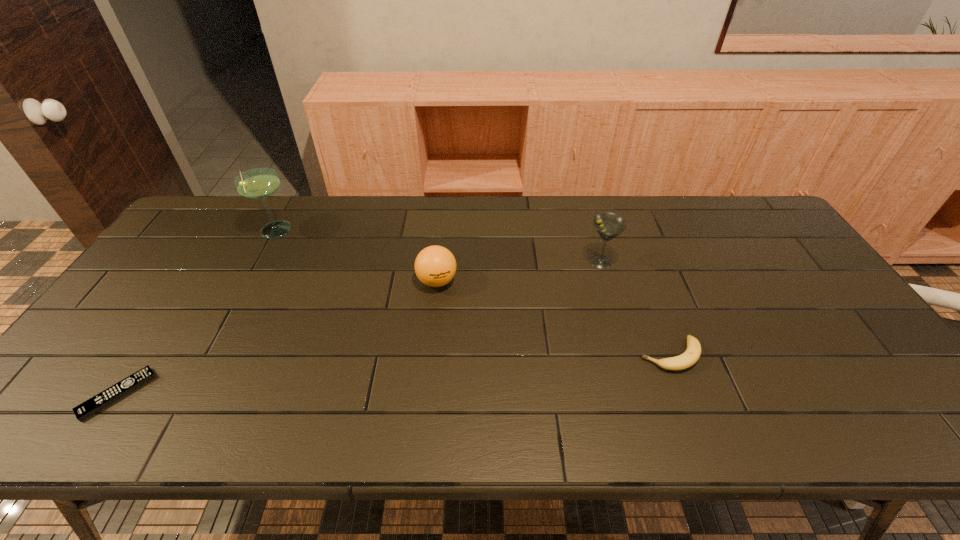
The height and width of the screenshot is (540, 960). In order to click on vacant space that's between the banana and the remote control in this screenshot , I will do `click(394, 375)`.

Where is `vacant space in between the third shortest object and the shorter martini`? vacant space in between the third shortest object and the shorter martini is located at coordinates (518, 272).

This screenshot has width=960, height=540. In order to click on free space between the third shortest object and the fourth tallest object in this screenshot , I will do `click(554, 318)`.

Select which object appears as the third closest to the fourth shortest object. Please provide its 2D coordinates. Your answer should be formatted as a tuple, i.e. [(x, y)], where the tuple contains the x and y coordinates of a point satisfying the conditions above.

[(259, 183)]

This screenshot has width=960, height=540. Identify the location of object identified as the second closest to the banana. (435, 266).

Locate an element on the screen. The width and height of the screenshot is (960, 540). free space that satisfies the following two spatial constraints: 1. on the front side of the second shortest object; 2. on the left side of the fourth object from right to left is located at coordinates (207, 355).

The width and height of the screenshot is (960, 540). What are the coordinates of `vacant space that satisfies the following two spatial constraints: 1. on the side with brand of the fourth tallest object; 2. on the right side of the third shortest object` in the screenshot? It's located at (429, 355).

Locate an element on the screen. The width and height of the screenshot is (960, 540). vacant position in the image that satisfies the following two spatial constraints: 1. on the side with brand of the banana; 2. on the left side of the third object from left to right is located at coordinates (429, 355).

Image resolution: width=960 pixels, height=540 pixels. What are the coordinates of `vacant space that satisfies the following two spatial constraints: 1. on the side with brand of the banana; 2. on the right side of the third tallest object` in the screenshot? It's located at (429, 355).

Find the location of a particular element. The width and height of the screenshot is (960, 540). vacant region that satisfies the following two spatial constraints: 1. on the side with brand of the second shortest object; 2. on the right side of the third shortest object is located at coordinates (429, 355).